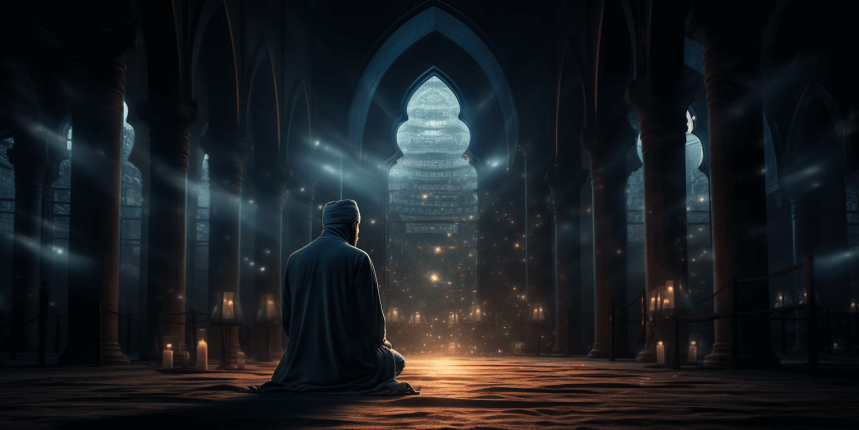
The height and width of the screenshot is (430, 859). Identify the location of floor. (526, 376).